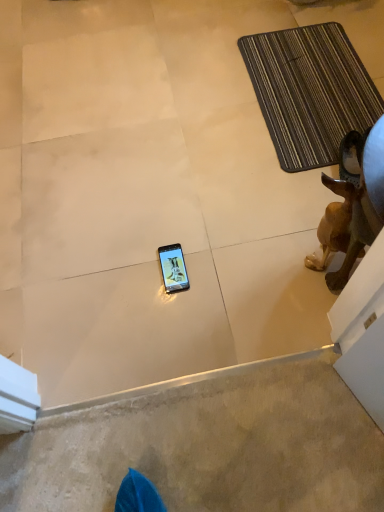
In order to click on vacant area that is in front of brown matte dog at right in this screenshot , I will do `click(307, 308)`.